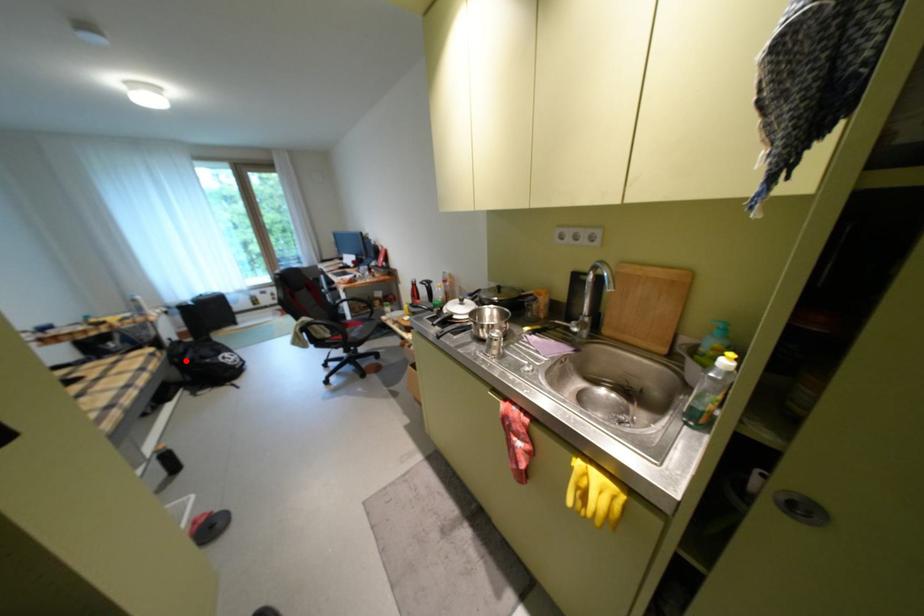
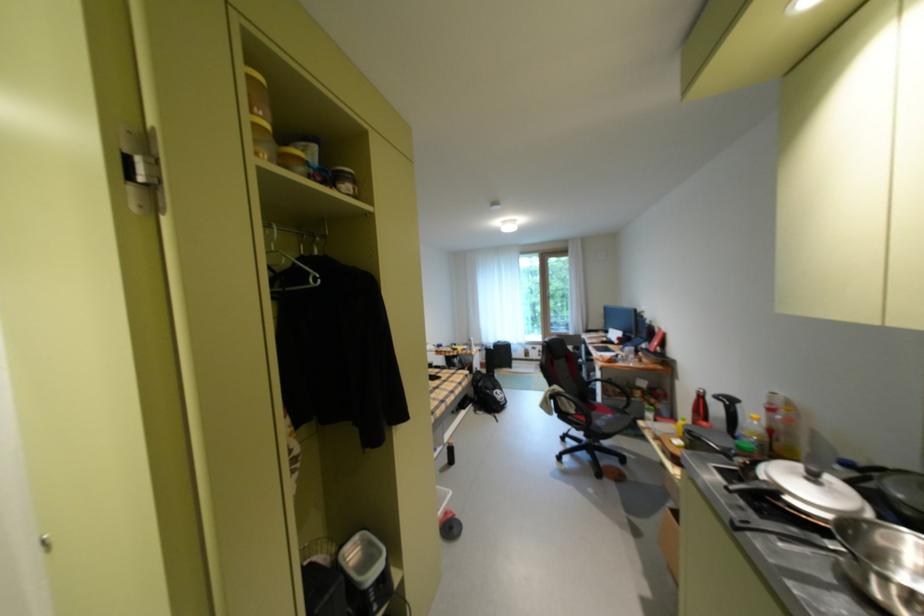
In the second image, find the point that corresponds to the highlighted location in the first image.

(484, 384)